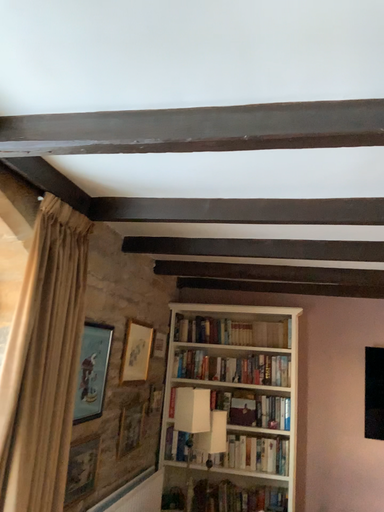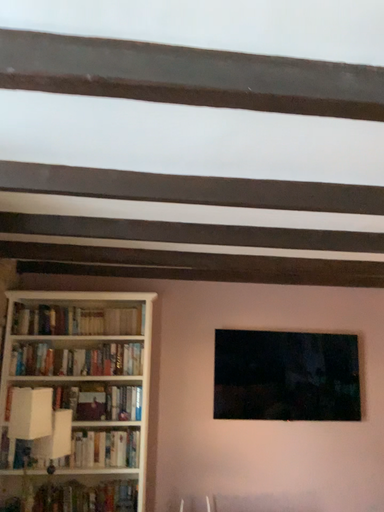
Question: How did the camera likely rotate when shooting the video?

Choices:
 (A) rotated left
 (B) rotated right

Answer: (B)